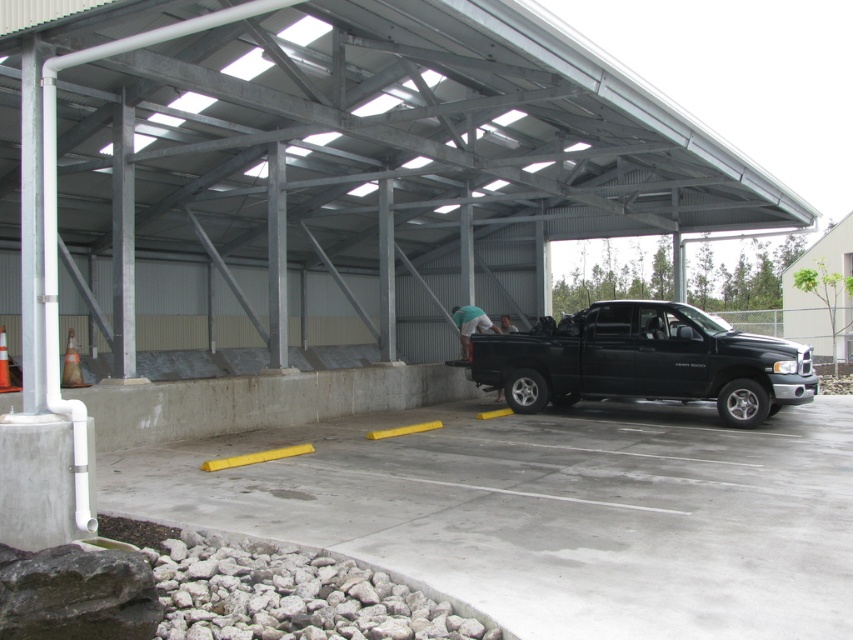
Who is higher up, concrete at center or black matte truck at center?

black matte truck at center

Locate an element on the screen. concrete at center is located at coordinates (552, 512).

Where is `concrete at center`? The height and width of the screenshot is (640, 853). concrete at center is located at coordinates (552, 512).